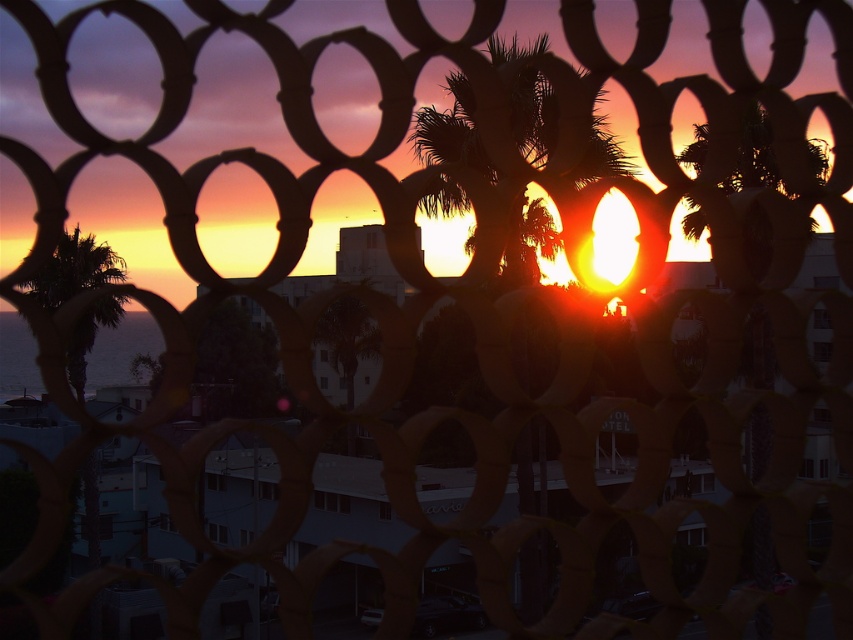
You are standing in front of the metal fence and see the silhouette leafy palm at center and the green leafy palm tree at left. Which palm tree is closer to the fence?

The silhouette leafy palm at center is closer to the fence than the green leafy palm tree at left because it is positioned to the right of it.